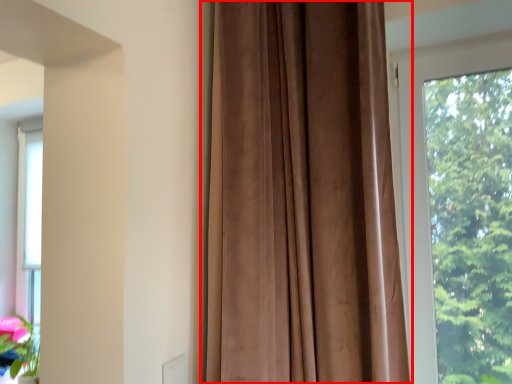
Question: From the image's perspective, where is curtain (annotated by the red box) located in relation to window in the image?

Choices:
 (A) below
 (B) above

Answer: (B)